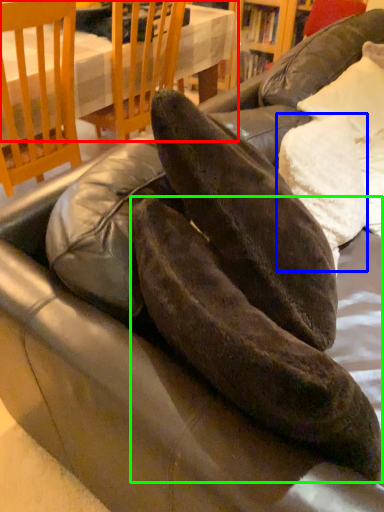
Question: Estimate the real-world distances between objects in this image. Which object is farther from table (highlighted by a red box), pillow (highlighted by a blue box) or leather shoe (highlighted by a green box)?

Choices:
 (A) pillow
 (B) leather shoe

Answer: (B)